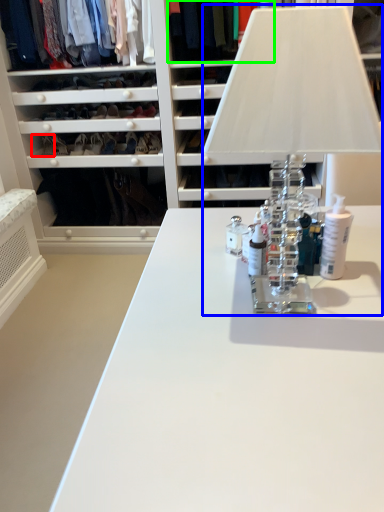
Question: Estimate the real-world distances between objects in this image. Which object is farther from shoe (highlighted by a red box), table lamp (highlighted by a blue box) or clothing (highlighted by a green box)?

Choices:
 (A) table lamp
 (B) clothing

Answer: (A)